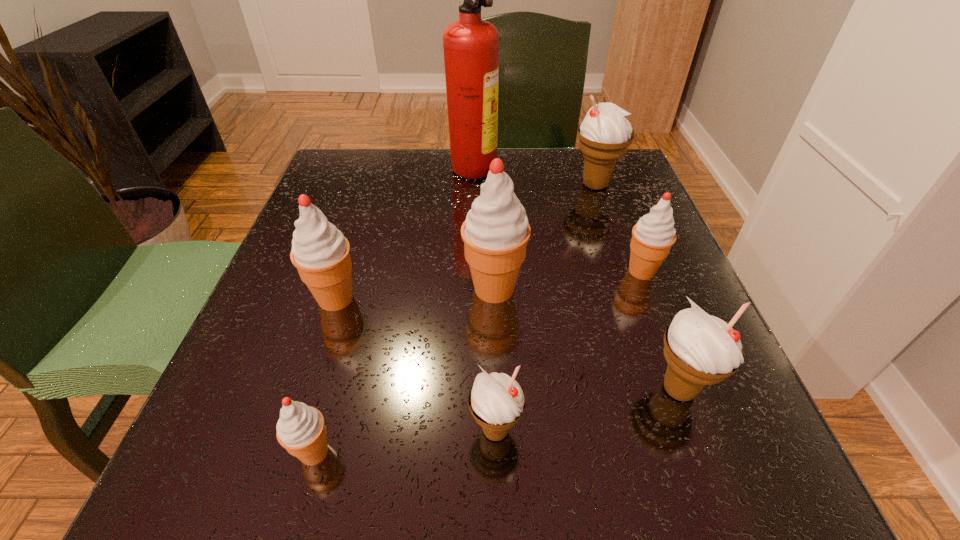
Locate an element on the screen. Image resolution: width=960 pixels, height=540 pixels. red fire extinguisher is located at coordinates (471, 45).

Where is `the tallest object`? The image size is (960, 540). the tallest object is located at coordinates (471, 45).

You are a GUI agent. You are given a task and a screenshot of the screen. Output one action in this format:
    pyautogui.click(x=<x>, y=<y>)
    Task: Click on the biggest red icecream
    
    Given the screenshot: What is the action you would take?
    pyautogui.click(x=495, y=233)

Identify the location of the second tallest object. The width and height of the screenshot is (960, 540). (495, 233).

You are a GUI agent. You are given a task and a screenshot of the screen. Output one action in this format:
    pyautogui.click(x=<x>, y=<y>)
    Task: Click on the biggest white icecream
    
    Given the screenshot: What is the action you would take?
    click(x=605, y=134)

The image size is (960, 540). I want to click on the farthest white icecream, so click(605, 134).

Image resolution: width=960 pixels, height=540 pixels. I want to click on the third smallest red icecream, so click(320, 252).

Find the location of a particular element. This screenshot has height=540, width=960. the rightmost red icecream is located at coordinates pos(654,234).

Locate an element on the screen. the second smallest white icecream is located at coordinates (700, 349).

Where is `the smallest red icecream`? the smallest red icecream is located at coordinates (301, 430).